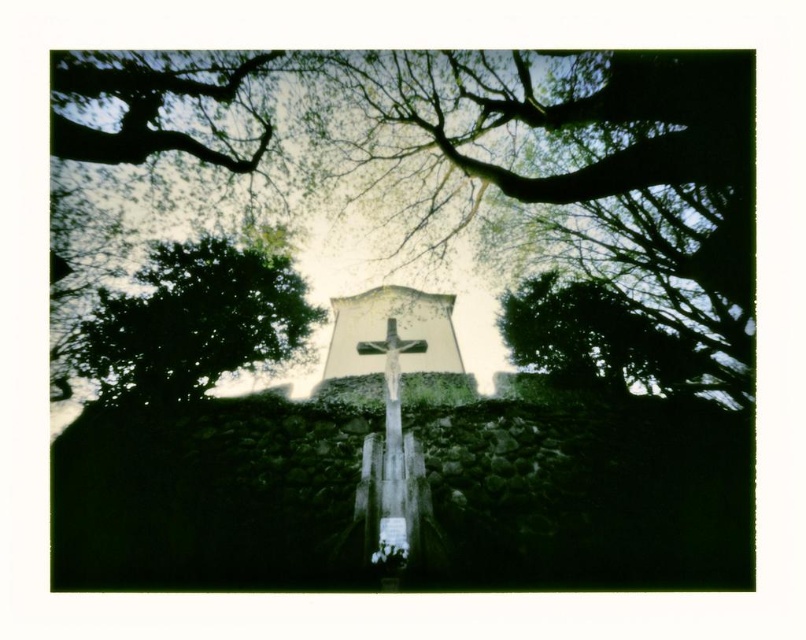
Is green leafy tree at upper center shorter than wooden cross at center?

No.

Between green leafy tree at upper center and wooden cross at center, which one appears on the left side from the viewer's perspective?

From the viewer's perspective, wooden cross at center appears more on the left side.

Find the location of a particular element. green leafy tree at upper center is located at coordinates (593, 339).

Does green leafy tree at upper center have a greater width compared to white matte cross at center?

No, green leafy tree at upper center is not wider than white matte cross at center.

From the picture: Does green leafy tree at upper center have a smaller size compared to white matte cross at center?

Yes, green leafy tree at upper center is smaller than white matte cross at center.

Does point (588, 380) lie behind point (393, 307)?

No, (588, 380) is in front of (393, 307).

Locate an element on the screen. Image resolution: width=806 pixels, height=640 pixels. green leafy tree at upper center is located at coordinates (593, 339).

Can you confirm if white matte cross at center is wider than wooden cross at center?

Yes.

Identify the location of white matte cross at center. (397, 348).

The height and width of the screenshot is (640, 806). What do you see at coordinates (397, 348) in the screenshot?
I see `white matte cross at center` at bounding box center [397, 348].

The width and height of the screenshot is (806, 640). I want to click on white matte cross at center, so click(x=397, y=348).